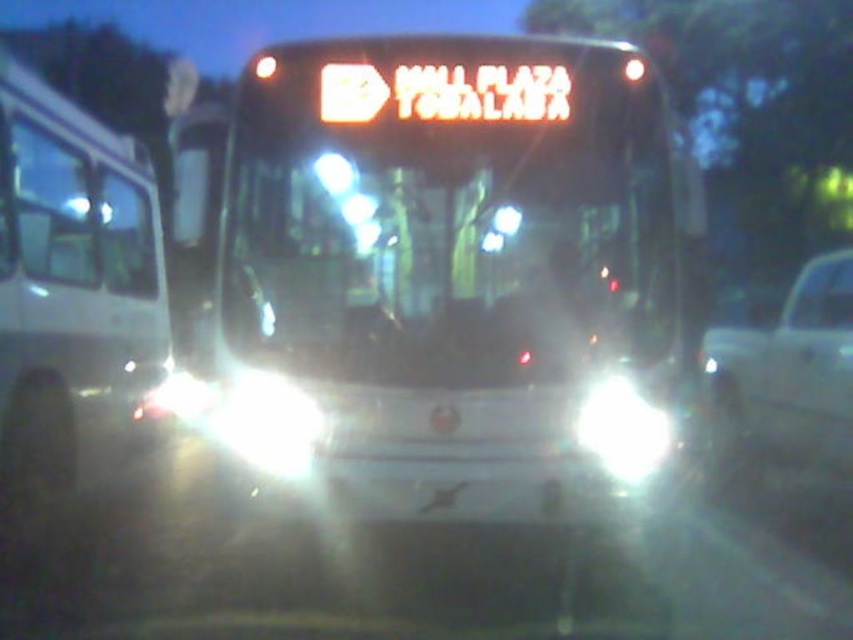
Which is above, transparent glass windshield at center or white glossy car at right?

white glossy car at right is higher up.

Who is shorter, transparent glass windshield at center or white glossy car at right?

With less height is transparent glass windshield at center.

Identify the location of transparent glass windshield at center. point(454,260).

Identify the location of transparent glass windshield at center. This screenshot has width=853, height=640. (454, 260).

Does point (466, 291) lie behind point (795, 433)?

No, it is not.

What do you see at coordinates (457, 259) in the screenshot?
I see `white glossy bus at center` at bounding box center [457, 259].

At what (x,y) coordinates should I click in order to perform the action: click on white glossy bus at center. Please return your answer as a coordinate pair (x, y). The image size is (853, 640). Looking at the image, I should click on (x=457, y=259).

Does white glossy car at right have a greater width compared to white glossy headlight at center?

Yes.

Describe the element at coordinates (798, 365) in the screenshot. I see `white glossy car at right` at that location.

Is point (836, 269) farther from viewer compared to point (663, 440)?

Yes, it is behind point (663, 440).

Locate an element on the screen. This screenshot has width=853, height=640. white glossy car at right is located at coordinates (798, 365).